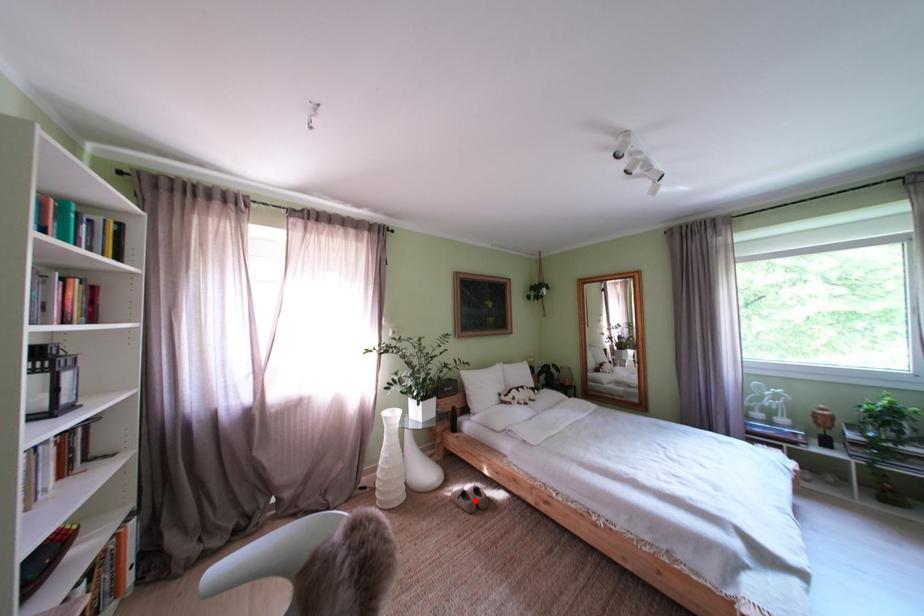
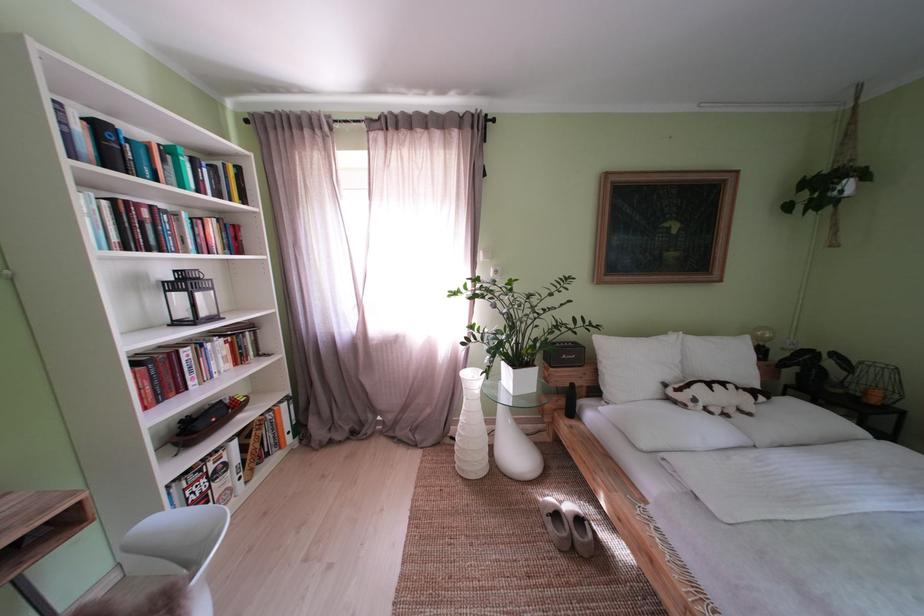
Question: I am providing you with two images of the same scene from different viewpoints. A red point is shown in image1. For the corresponding object point in image2, is it positioned nearer or farther from the camera?

Choices:
 (A) Nearer
 (B) Farther

Answer: (B)